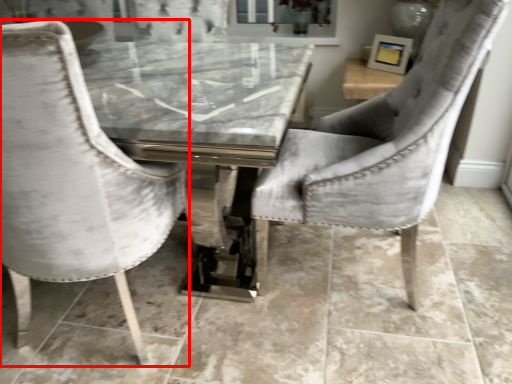
Question: Considering the relative positions of chair (annotated by the red box) and chair in the image provided, where is chair (annotated by the red box) located with respect to the staircase?

Choices:
 (A) left
 (B) right

Answer: (A)